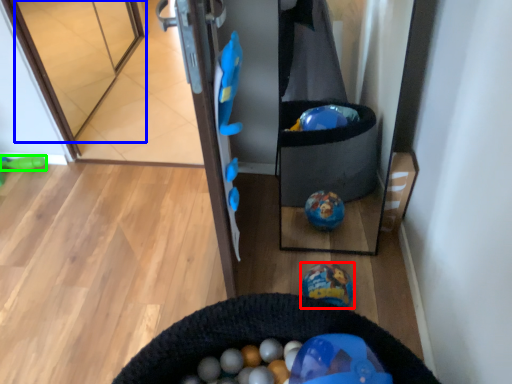
Question: Which object is positioned farthest from toy (highlighted by a red box)? Select from glass door (highlighted by a blue box) and toy (highlighted by a green box).

Choices:
 (A) glass door
 (B) toy

Answer: (A)